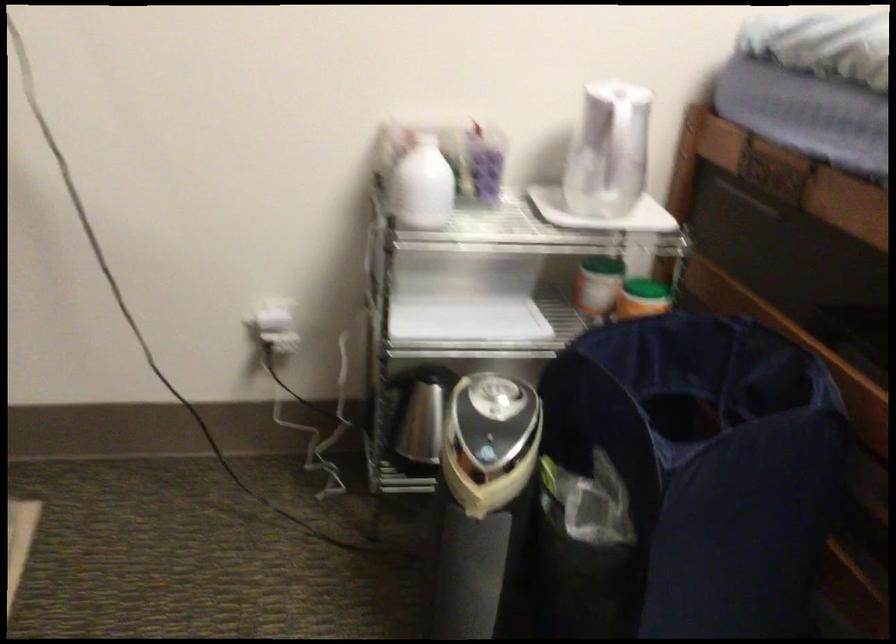
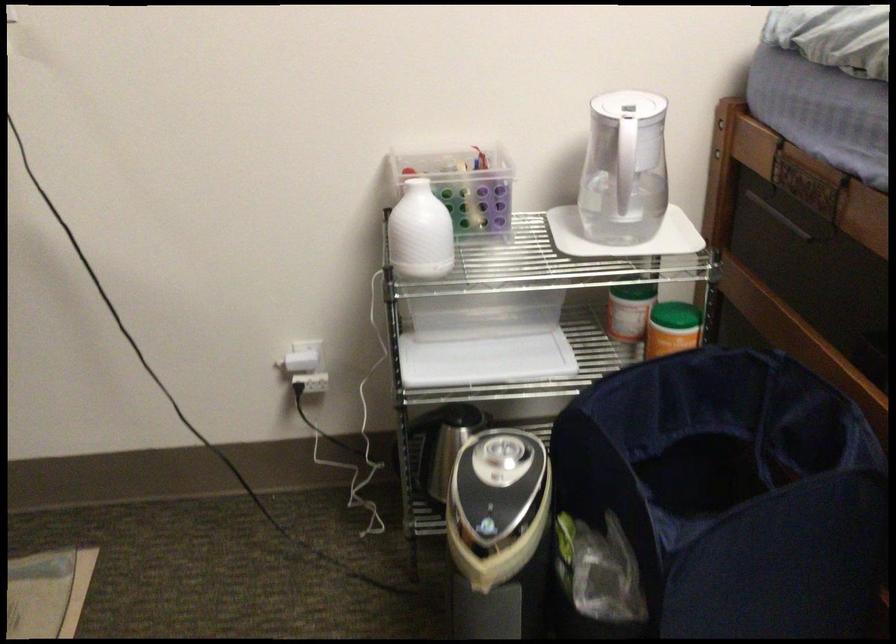
Where in the second image is the point corresponding to (x=428, y=183) from the first image?

(419, 232)